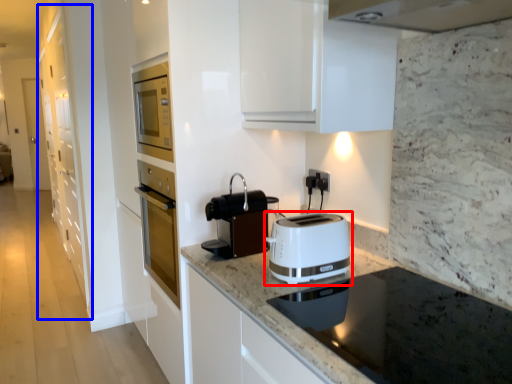
Question: Which object is closer to the camera taking this photo, toaster (highlighted by a red box) or cabinetry (highlighted by a blue box)?

Choices:
 (A) toaster
 (B) cabinetry

Answer: (A)